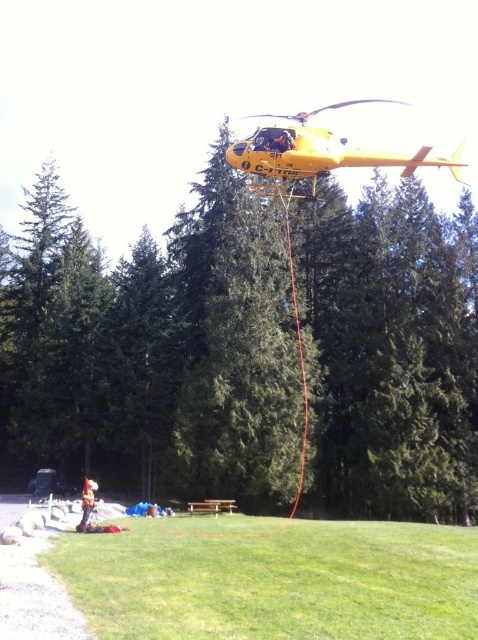
You are a safety inspector reviewing this scene. The green textured tree at center and the orange reflective vest at lower center are both in your line of sight. According to the image, which object is located higher from the ground?

The green textured tree at center is positioned over orange reflective vest at lower center, so the tree is higher from the ground than the vest.

You are a safety inspector assessing the scene. The yellow matte helicopter at upper center and the orange reflective vest at lower center are both visible. Which object is positioned higher in the image?

The yellow matte helicopter at upper center is positioned higher in the image than the orange reflective vest at lower center.